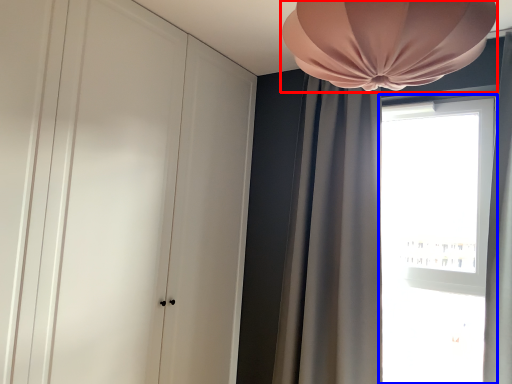
Question: Among these objects, which one is farthest to the camera, lamp (highlighted by a red box) or window (highlighted by a blue box)?

Choices:
 (A) lamp
 (B) window

Answer: (B)